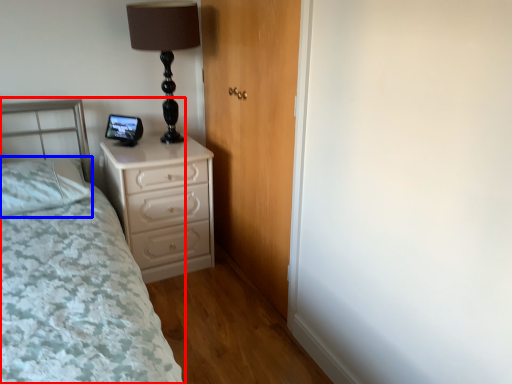
Question: Which object is closer to the camera taking this photo, bed (highlighted by a red box) or pillow (highlighted by a blue box)?

Choices:
 (A) bed
 (B) pillow

Answer: (A)